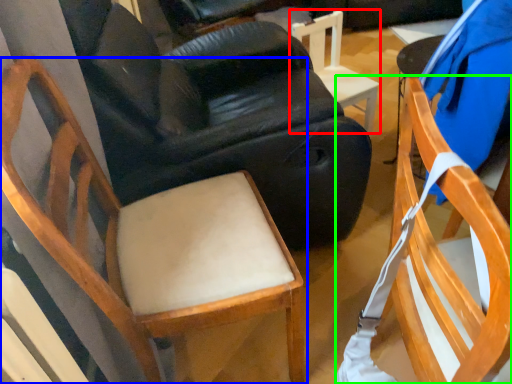
Question: Estimate the real-world distances between objects in this image. Which object is closer to chair (highlighted by a red box), chair (highlighted by a blue box) or chair (highlighted by a green box)?

Choices:
 (A) chair
 (B) chair

Answer: (A)